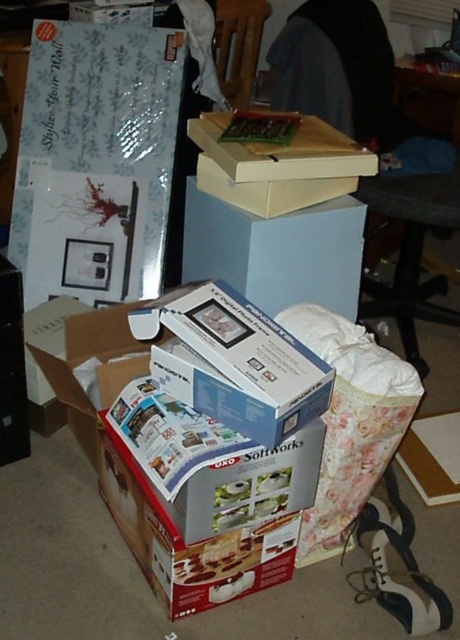
Is light blue cardboard box at center wider than matte cardboard box at upper center?

Yes.

Between light blue cardboard box at center and matte cardboard box at upper center, which one is positioned higher?

matte cardboard box at upper center is higher up.

Which is in front, point (196, 218) or point (218, 150)?

Point (218, 150) is in front.

Find the location of a particular element. The height and width of the screenshot is (640, 460). light blue cardboard box at center is located at coordinates (276, 252).

Can you confirm if white matte box at center is positioned to the left of light blue cardboard box at center?

Indeed, white matte box at center is positioned on the left side of light blue cardboard box at center.

Describe the element at coordinates (241, 360) in the screenshot. I see `white matte box at center` at that location.

Locate an element on the screen. white matte box at center is located at coordinates (241, 360).

Who is higher up, white matte box at center or matte cardboard box at upper center?

Positioned higher is matte cardboard box at upper center.

Based on the photo, is white matte box at center closer to the viewer compared to matte cardboard box at upper center?

Yes, it is.

Is point (279, 396) farther from camera compared to point (341, 140)?

That is False.

Locate an element on the screen. white matte box at center is located at coordinates (241, 360).